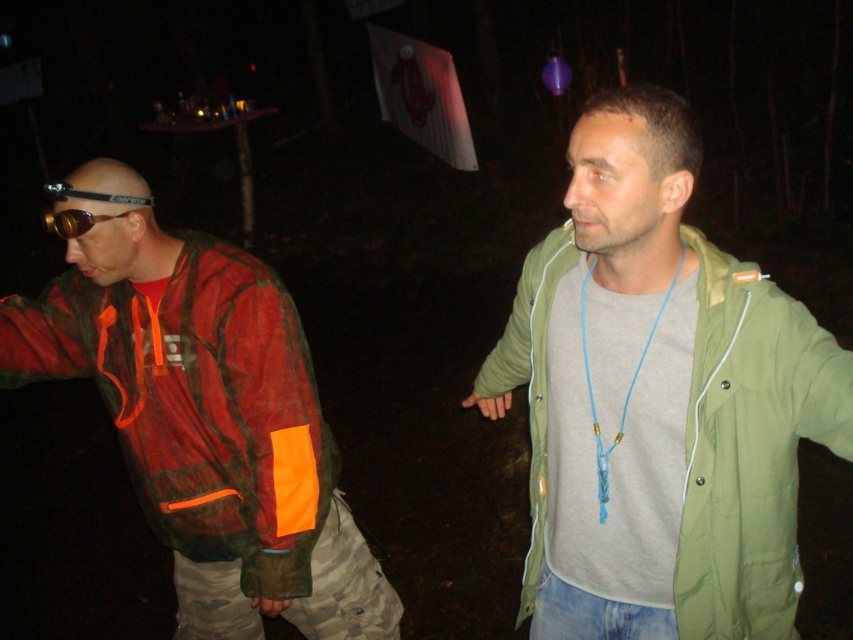
Question: Which of the following is the closest to the observer?

Choices:
 (A) blue string necklace at center
 (B) green fabric jacket at center
 (C) orange mesh jacket at left
 (D) matte black goggles at left

Answer: (B)

Question: Can you confirm if green fabric jacket at center is bigger than blue string necklace at center?

Choices:
 (A) no
 (B) yes

Answer: (B)

Question: Which object appears farthest from the camera in this image?

Choices:
 (A) blue string necklace at center
 (B) green fabric jacket at center
 (C) orange mesh jacket at left
 (D) matte black goggles at left

Answer: (D)

Question: Can you confirm if orange mesh jacket at left is positioned below blue string necklace at center?

Choices:
 (A) yes
 (B) no

Answer: (A)

Question: Is green fabric jacket at center in front of matte black goggles at left?

Choices:
 (A) no
 (B) yes

Answer: (B)

Question: Based on their relative distances, which object is farther from the matte black goggles at left?

Choices:
 (A) orange mesh jacket at left
 (B) blue string necklace at center

Answer: (B)